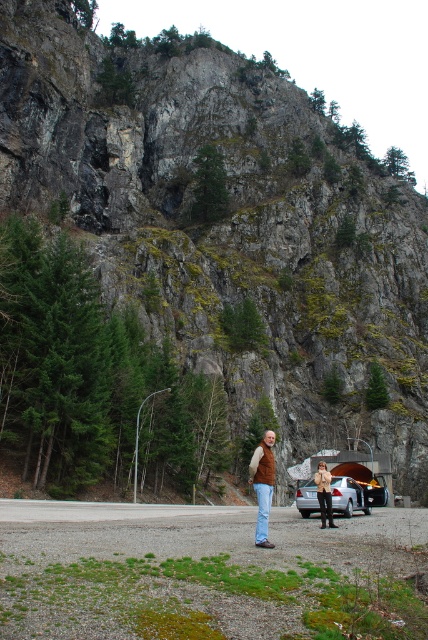
You are a photographer trying to capture a photo of the brown suede vest at center and the metallic silver baby carriage at center. Since you want both subjects to be clearly visible in the frame, would the vest block the view of the baby carriage?

The brown suede vest at center is taller than the metallic silver baby carriage at center, so the vest may block the view of the baby carriage depending on their positions.

You are a fashion designer observing the image. You see a brown suede vest at center and a brown suede jacket at center. Which one has a larger size?

The brown suede vest at center is bigger than the brown suede jacket at center.